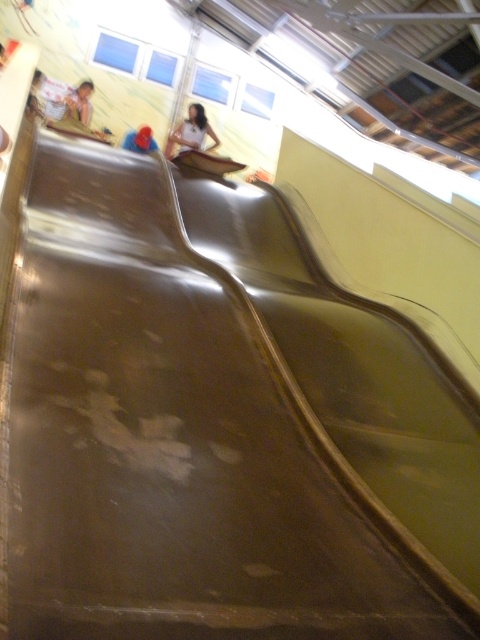
Question: Which of the following is the farthest from the observer?

Choices:
 (A) (140, 144)
 (B) (72, 108)

Answer: (B)

Question: Which point is farther from the camera taking this photo?

Choices:
 (A) (200, 115)
 (B) (86, 99)

Answer: (B)

Question: Does smooth white shirt at upper center appear over blue fabric at upper center?

Choices:
 (A) no
 (B) yes

Answer: (A)

Question: Does smooth skin person at upper left have a lesser width compared to blue fabric at upper center?

Choices:
 (A) no
 (B) yes

Answer: (B)

Question: Which object is closer to the camera taking this photo?

Choices:
 (A) blue fabric at upper center
 (B) smooth white shirt at upper center

Answer: (B)

Question: Is smooth white shirt at upper center positioned behind smooth skin person at upper left?

Choices:
 (A) yes
 (B) no

Answer: (B)